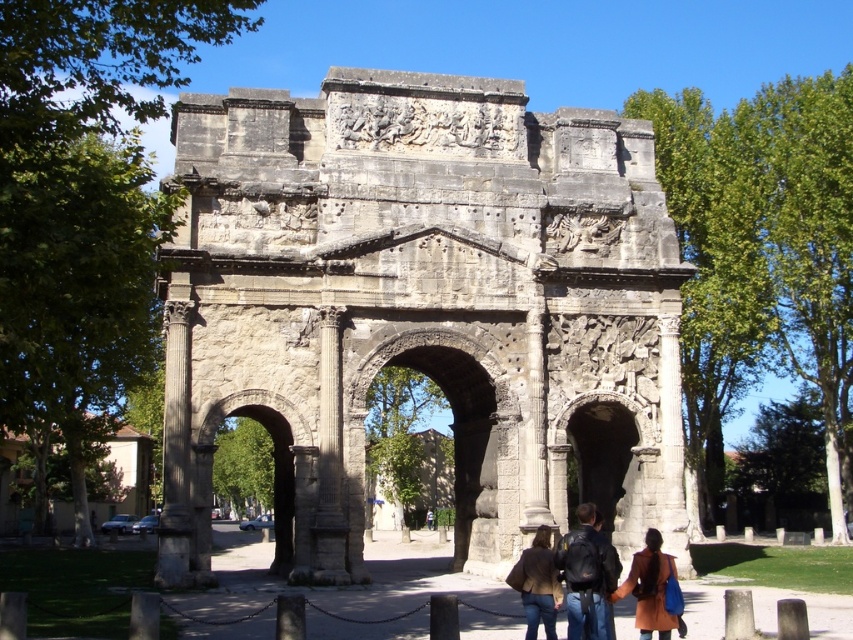
Question: Among these objects, which one is nearest to the camera?

Choices:
 (A) gray stone column at left
 (B) brown leather jacket at center

Answer: (B)

Question: From the image, what is the correct spatial relationship of gray stone archway at center in relation to olive brown leather coat at center?

Choices:
 (A) below
 (B) above

Answer: (B)

Question: Is gray stone archway at center smaller than olive brown leather coat at center?

Choices:
 (A) yes
 (B) no

Answer: (B)

Question: Which of these objects is positioned farthest from the olive brown leather coat at center?

Choices:
 (A) brown leather jacket at center
 (B) gray stone archway at left
 (C) dark blue leather jacket at center
 (D) gray stone column at center

Answer: (B)

Question: Which point appears closest to the camera in this image?

Choices:
 (A) (170, 458)
 (B) (340, 524)
 (C) (492, 451)

Answer: (A)

Question: Is gray stone column at left thinner than dark blue leather jacket at center?

Choices:
 (A) yes
 (B) no

Answer: (B)